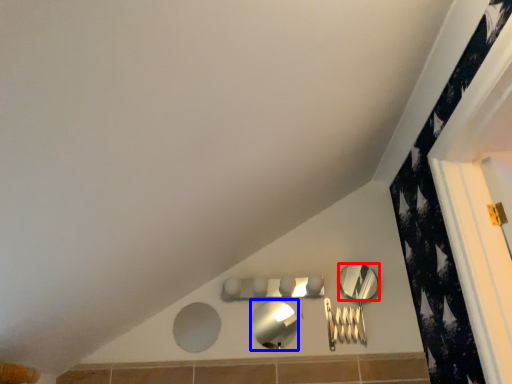
Question: Which of the following is the closest to the observer, mirror (highlighted by a red box) or mirror (highlighted by a blue box)?

Choices:
 (A) mirror
 (B) mirror

Answer: (B)